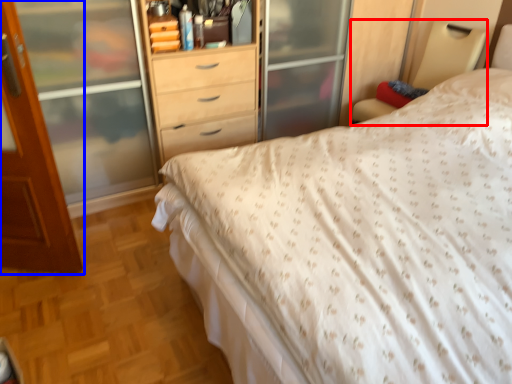
Question: Which point is closer to the camera, bed frame (highlighted by a red box) or door (highlighted by a blue box)?

Choices:
 (A) bed frame
 (B) door

Answer: (B)